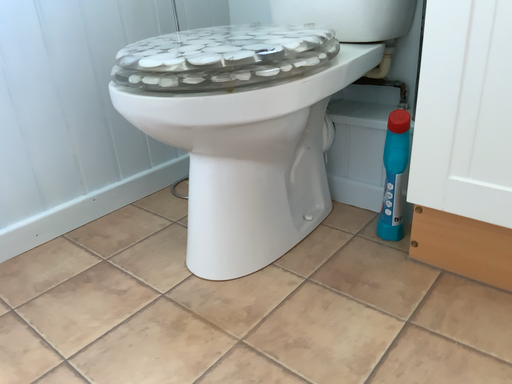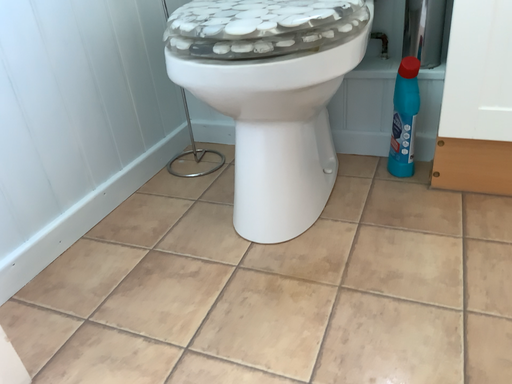
Question: How did the camera likely rotate when shooting the video?

Choices:
 (A) rotated right
 (B) rotated left

Answer: (A)